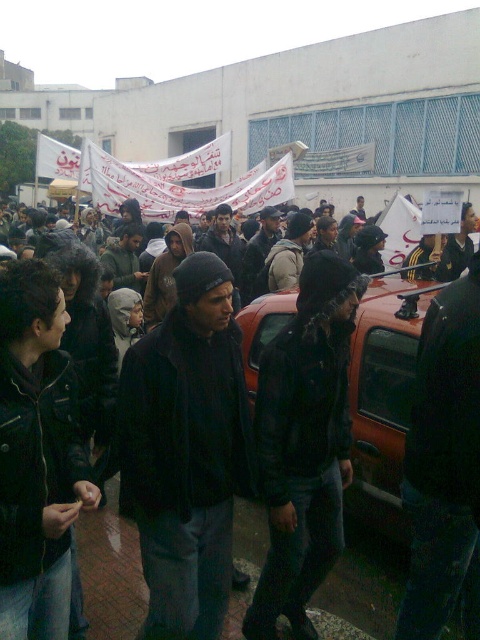
You are a photographer trying to capture a clear shot of the black leather jacket at center and the orange matte car at center. Which object should you zoom in on to ensure it fills the frame without cropping?

The orange matte car at center is larger than the black leather jacket at center, so you should zoom in on the black leather jacket at center to ensure it fills the frame without cropping.

You are a photographer trying to capture a clear shot of both the black matte jacket at center and the black leather jacket at center. Given that your camera can only focus on objects within a 30cm width limit, will you be able to frame both jackets without cropping either of them?

The black matte jacket at center is wider than the black leather jacket at center. Since the total width required to frame both would exceed the camera sensor limit of 30cm, you might need to adjust your position or use a different lens to accommodate the combined width.

You are a photographer standing at the camera position. You want to take a photo of the point at coordinates point (x=164, y=433). Can you estimate how far you need to move forward to focus on that point?

The distance between point (x=164, y=433) and the camera is 2.35 meters, so you need to move forward approximately 2.35 meters to focus on that point.